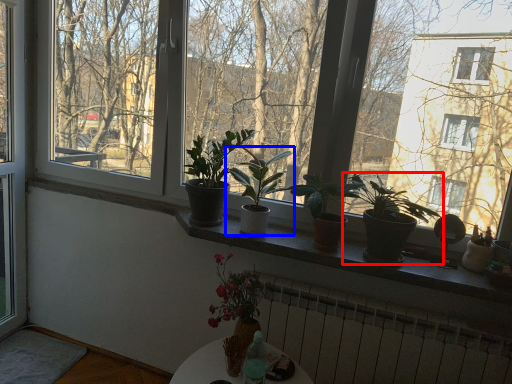
Question: Which point is further to the camera, houseplant (highlighted by a red box) or houseplant (highlighted by a blue box)?

Choices:
 (A) houseplant
 (B) houseplant

Answer: (B)